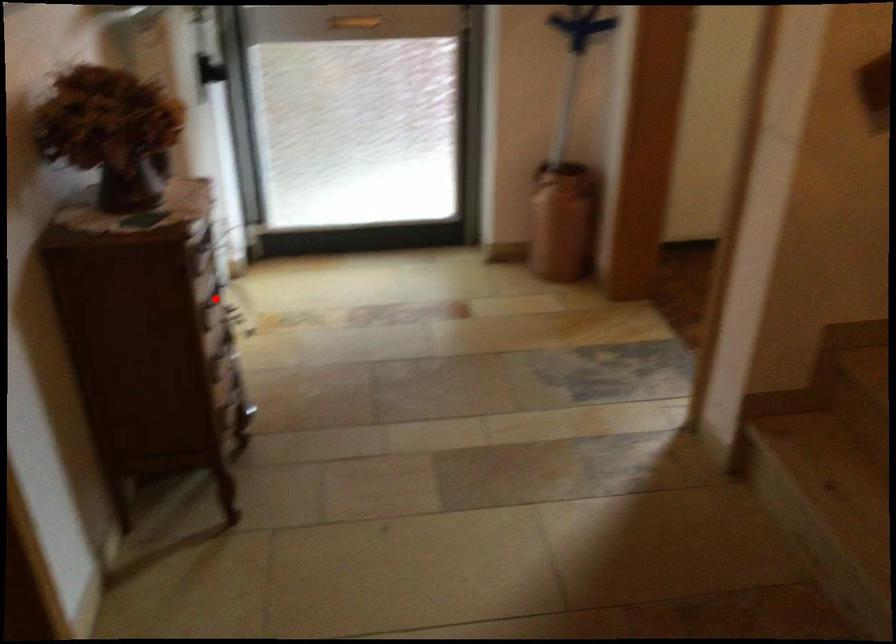
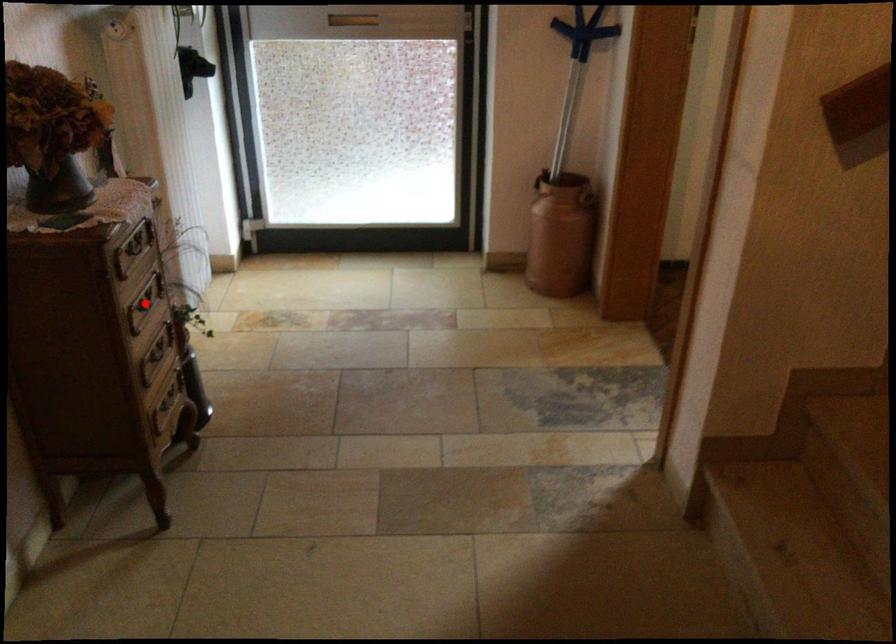
I am providing you with two images of the same scene from different viewpoints. A red point is marked on the first image and another point is marked on the second image. Is the red point in image1 aligned with the point shown in image2?

Yes